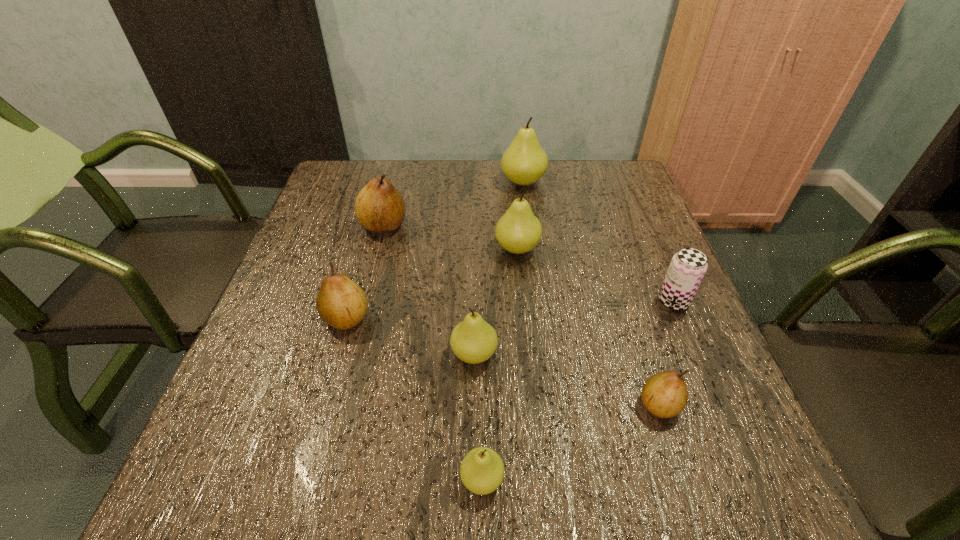
I want to click on the nearest object, so click(x=482, y=470).

Identify the location of the nearest green pear. The image size is (960, 540). (482, 470).

Where is `free space located on the front of the farthest object`? This screenshot has height=540, width=960. free space located on the front of the farthest object is located at coordinates (527, 212).

Identify the location of vacant region located 0.290m on the right of the biggest brown pear. (519, 226).

At what (x,y) coordinates should I click in order to perform the action: click on vacant space situated on the right of the third smallest green pear. Please return your answer as a coordinate pair (x, y). The width and height of the screenshot is (960, 540). Looking at the image, I should click on (634, 248).

Where is `vacant space located on the back of the second nearest green pear`? vacant space located on the back of the second nearest green pear is located at coordinates (474, 313).

I want to click on vacant region located on the left of the second farthest brown pear, so click(x=294, y=318).

Locate an element on the screen. free space located on the front of the purple beer can is located at coordinates (741, 457).

Find the location of a particular element. The image size is (960, 540). free point located 0.280m on the left of the rightmost pear is located at coordinates (478, 404).

Locate an element on the screen. blank space located 0.210m on the left of the nearest green pear is located at coordinates (324, 480).